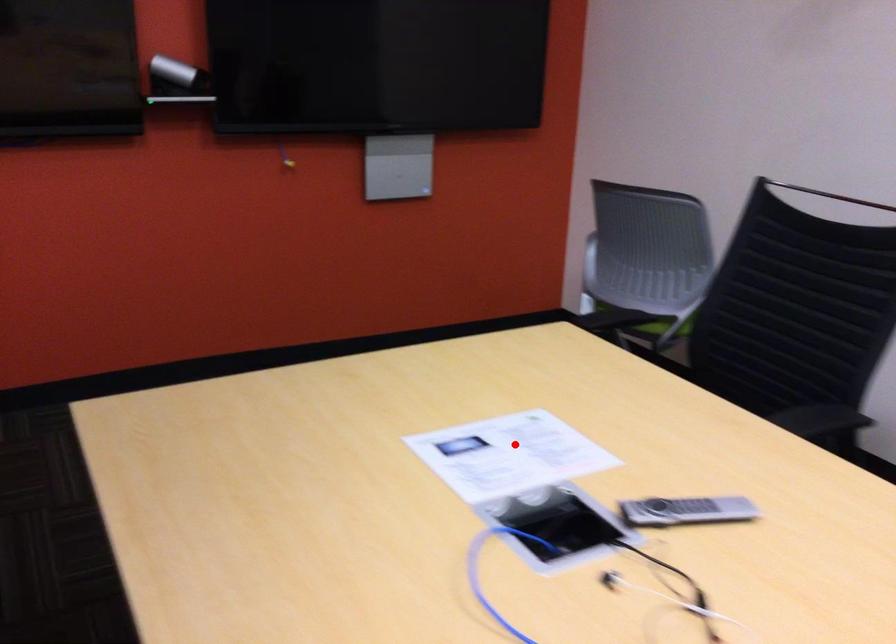
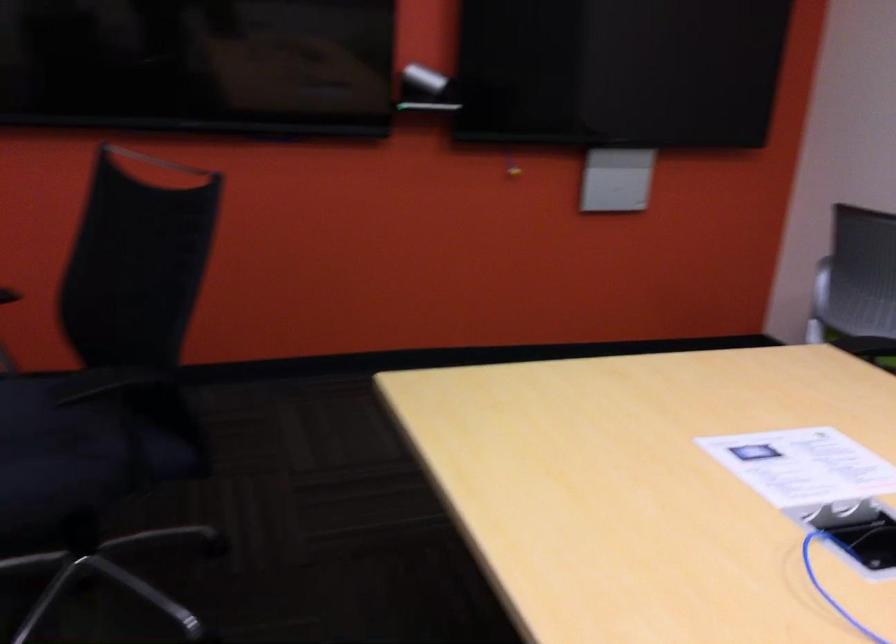
Locate, in the second image, the point that corresponds to the highlighted location in the first image.

(803, 466)